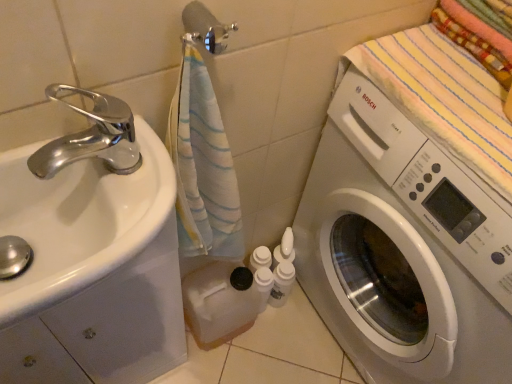
Question: Is striped cotton beach towel at upper right at the right side of silver metallic towel bar at upper center?

Choices:
 (A) yes
 (B) no

Answer: (A)

Question: Does striped cotton beach towel at upper right have a lesser height compared to silver metallic towel bar at upper center?

Choices:
 (A) yes
 (B) no

Answer: (B)

Question: Does striped cotton beach towel at upper right have a greater width compared to silver metallic towel bar at upper center?

Choices:
 (A) yes
 (B) no

Answer: (A)

Question: Is silver metallic towel bar at upper center at the back of striped cotton beach towel at upper right?

Choices:
 (A) yes
 (B) no

Answer: (B)

Question: From the image's perspective, is striped cotton beach towel at upper right beneath silver metallic towel bar at upper center?

Choices:
 (A) no
 (B) yes

Answer: (B)

Question: From a real-world perspective, is striped cotton beach towel at upper right physically above silver metallic towel bar at upper center?

Choices:
 (A) yes
 (B) no

Answer: (B)

Question: Is silver metallic towel bar at upper center further to the viewer compared to white glossy sink at left?

Choices:
 (A) no
 (B) yes

Answer: (B)

Question: From a real-world perspective, is silver metallic towel bar at upper center positioned over white glossy sink at left based on gravity?

Choices:
 (A) no
 (B) yes

Answer: (B)

Question: Considering the relative sizes of silver metallic towel bar at upper center and white glossy sink at left in the image provided, is silver metallic towel bar at upper center bigger than white glossy sink at left?

Choices:
 (A) no
 (B) yes

Answer: (A)

Question: Does silver metallic towel bar at upper center have a greater height compared to white glossy sink at left?

Choices:
 (A) no
 (B) yes

Answer: (A)

Question: From a real-world perspective, is silver metallic towel bar at upper center under white glossy sink at left?

Choices:
 (A) yes
 (B) no

Answer: (B)

Question: Is silver metallic towel bar at upper center placed right next to white glossy sink at left?

Choices:
 (A) yes
 (B) no

Answer: (B)

Question: Is white glossy washing machine at right closer to the viewer compared to white glossy sink at left?

Choices:
 (A) yes
 (B) no

Answer: (B)